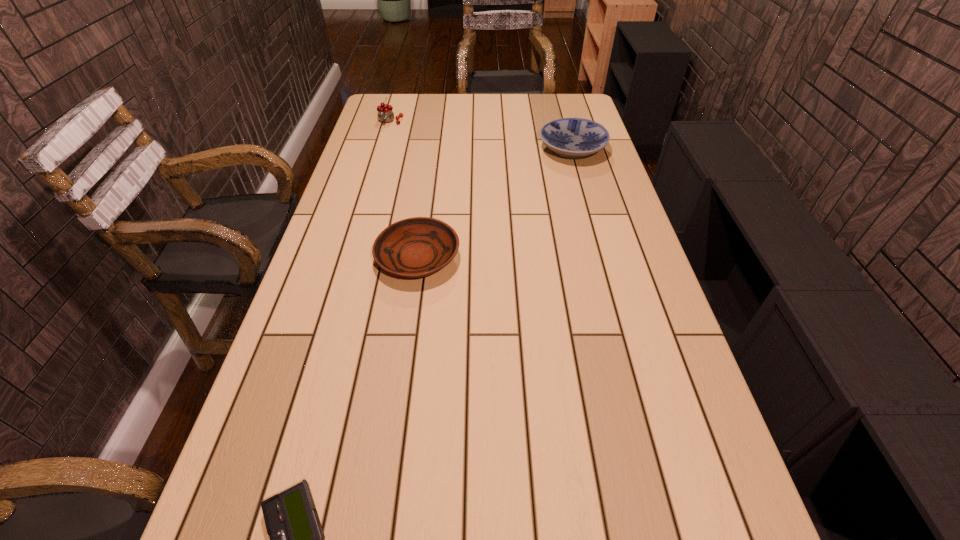
Image resolution: width=960 pixels, height=540 pixels. Find the location of `cherry`. cherry is located at coordinates (385, 114).

Locate an element on the screen. Image resolution: width=960 pixels, height=540 pixels. the farthest object is located at coordinates (385, 114).

Locate an element on the screen. This screenshot has height=540, width=960. the right plate is located at coordinates (572, 138).

You are a GUI agent. You are given a task and a screenshot of the screen. Output one action in this format:
    pyautogui.click(x=<x>, y=<y>)
    Task: Click on the second farthest object
    The image size is (960, 540).
    Given the screenshot: What is the action you would take?
    pyautogui.click(x=572, y=138)

Locate an element on the screen. This screenshot has width=960, height=540. the second shortest object is located at coordinates (415, 247).

At what (x,y) coordinates should I click in order to perform the action: click on the shorter plate. Please return your answer as a coordinate pair (x, y). This screenshot has height=540, width=960. Looking at the image, I should click on (415, 247).

Find the location of `vacant area located 0.070m on the handle side of the farthest object`. vacant area located 0.070m on the handle side of the farthest object is located at coordinates (386, 136).

At what (x,y) coordinates should I click in order to perform the action: click on vacant area located on the left of the right plate. Please return your answer as a coordinate pair (x, y). Looking at the image, I should click on (484, 150).

This screenshot has width=960, height=540. Identify the location of vacant area situated on the back of the second shortest object. (424, 212).

Find the location of `object located in the far edge section of the desktop`. object located in the far edge section of the desktop is located at coordinates (385, 114).